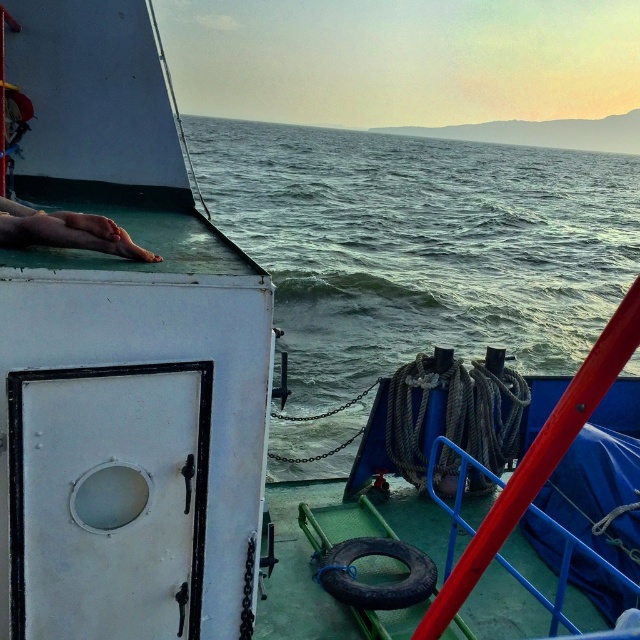
Question: Which object appears closest to the camera in this image?

Choices:
 (A) skinny flesh at lower left
 (B) greenish-blue water at center

Answer: (A)

Question: Can you confirm if greenish-blue water at center is smaller than skinny flesh at lower left?

Choices:
 (A) no
 (B) yes

Answer: (A)

Question: Which object appears closest to the camera in this image?

Choices:
 (A) greenish-blue water at center
 (B) skinny flesh at lower left

Answer: (B)

Question: Does greenish-blue water at center appear over skinny flesh at lower left?

Choices:
 (A) no
 (B) yes

Answer: (B)

Question: Among these points, which one is farthest from the camera?

Choices:
 (A) (115, 237)
 (B) (362, 333)

Answer: (B)

Question: Can you confirm if greenish-blue water at center is positioned below skinny flesh at lower left?

Choices:
 (A) no
 (B) yes

Answer: (A)